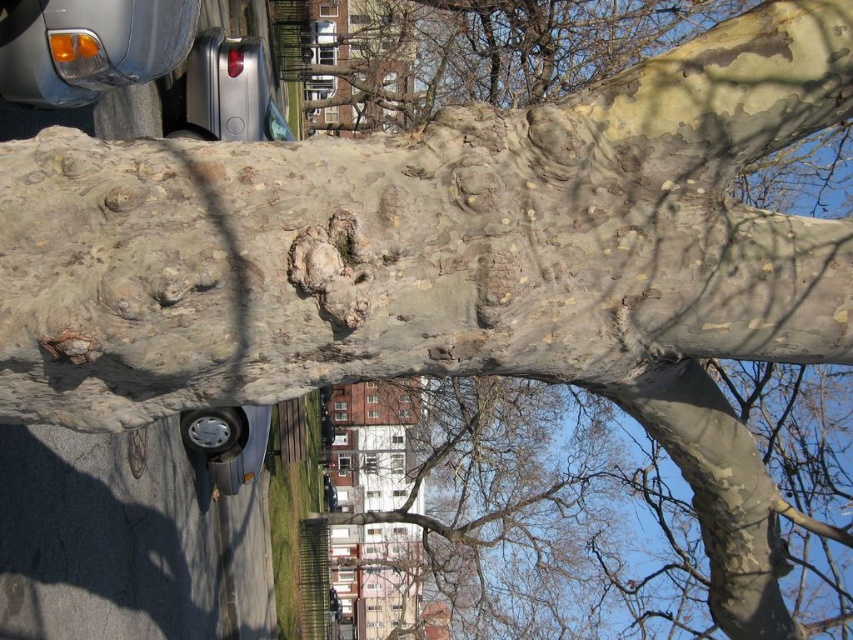
Describe the element at coordinates (88, 45) in the screenshot. I see `metallic gray headlight at upper left` at that location.

Does metallic gray headlight at upper left have a lesser width compared to shiny silver hubcap at lower center?

Yes.

This screenshot has height=640, width=853. I want to click on metallic gray headlight at upper left, so click(88, 45).

Who is higher up, leathery bark tree trunk at upper center or metallic gray headlight at upper left?

leathery bark tree trunk at upper center is higher up.

Who is more distant from viewer, (496, 26) or (79, 20)?

The point (496, 26) is more distant.

The height and width of the screenshot is (640, 853). Find the location of `leathery bark tree trunk at upper center`. leathery bark tree trunk at upper center is located at coordinates (489, 51).

Can you confirm if leathery bark tree trunk at upper center is positioned above shiny silver hubcap at lower center?

Indeed, leathery bark tree trunk at upper center is positioned over shiny silver hubcap at lower center.

Describe the element at coordinates (489, 51) in the screenshot. This screenshot has width=853, height=640. I see `leathery bark tree trunk at upper center` at that location.

Between point (363, 58) and point (218, 454), which one is positioned in front?

Point (218, 454) is in front.

Identify the location of leathery bark tree trunk at upper center. This screenshot has height=640, width=853. (489, 51).